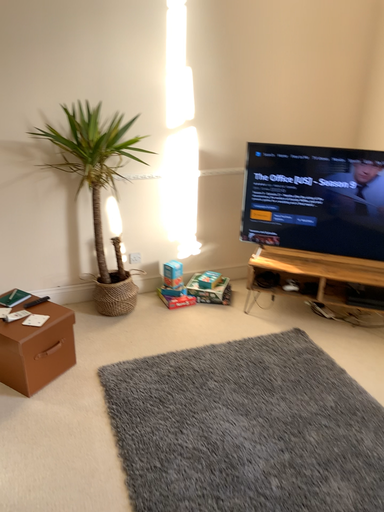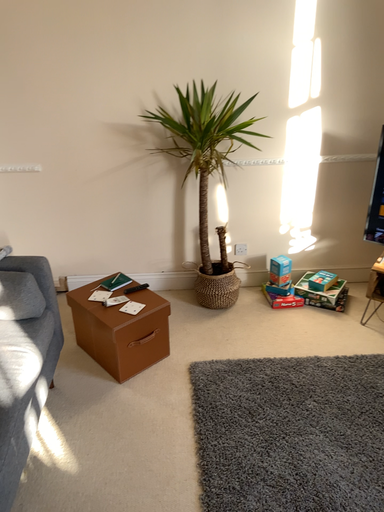
Question: Which way did the camera rotate in the video?

Choices:
 (A) rotated left
 (B) rotated right

Answer: (A)